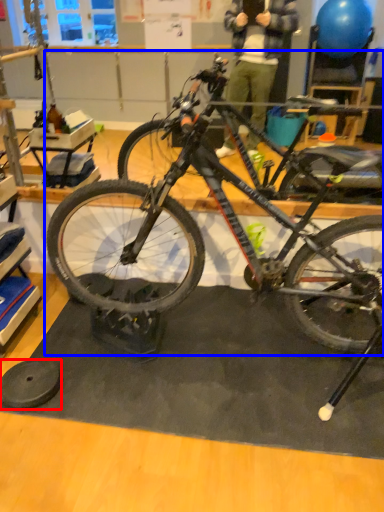
Question: Among these objects, which one is nearest to the camera, wheel (highlighted by a red box) or bicycle (highlighted by a blue box)?

Choices:
 (A) wheel
 (B) bicycle

Answer: (B)